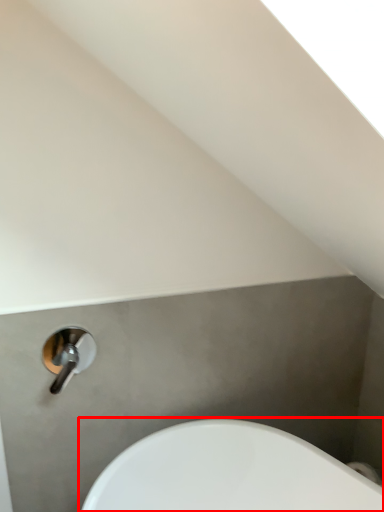
Question: From the image's perspective, where is sink (annotated by the red box) located in relation to tap in the image?

Choices:
 (A) above
 (B) below

Answer: (B)